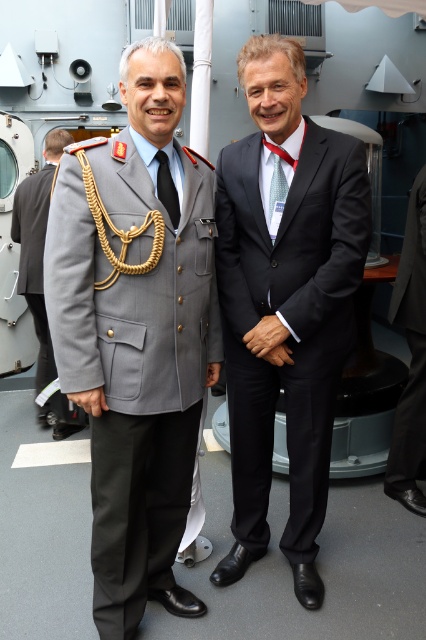
You are navigating a small drone that needs to fly from point A to point B in the scene. The two points are labeled as point (342, 195) and point (48, 160). According to their positions, which point should you start from and which should be your destination to ensure the drone flies forward in the direction it is facing?

The drone should start at point (48, 160) and fly towards point (342, 195) because point (342, 195) is in front of point (48, 160), so flying from the latter to the former would be moving forward in the drone s facing direction.

Based on the scene description, where exactly is the light blue silk tie at center located in the image?

The light blue silk tie at center is located at point coordinates of (278, 186).

You are a photographer preparing to take a group photo of the black glossy suit at center and the gray wool military uniform at center. Considering their spatial presence, which one should you position closer to the camera to ensure both are equally visible in the frame?

Since the black glossy suit at center occupies less space than the gray wool military uniform at center, you should position the black glossy suit at center closer to the camera to balance their visibility in the photo.